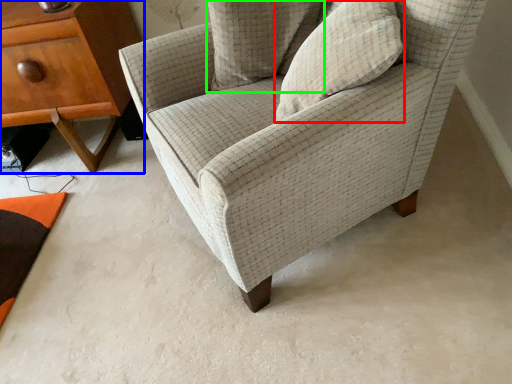
Question: Which object is the farthest from pillow (highlighted by a red box)? Choose among these: nightstand (highlighted by a blue box) or pillow (highlighted by a green box).

Choices:
 (A) nightstand
 (B) pillow

Answer: (A)